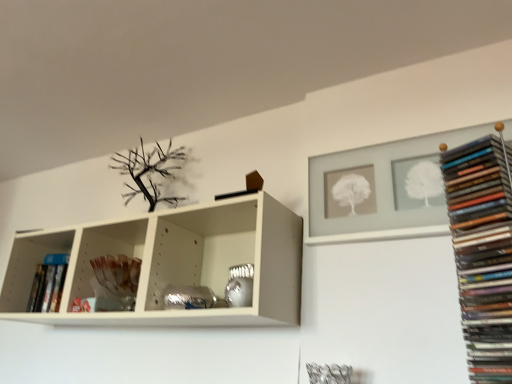
Question: Is hardcover book at left, arranged as the first book when viewed from the left, surrounded by translucent glass vase at center, the 2th shelf from the right?

Choices:
 (A) yes
 (B) no

Answer: (B)

Question: Is translucent glass vase at center, which ranks as the 2th shelf in top-to-bottom order, located outside hardcover book at left, arranged as the first book when viewed from the left?

Choices:
 (A) no
 (B) yes

Answer: (B)

Question: Is translucent glass vase at center, which ranks as the 2th shelf in top-to-bottom order, touching hardcover book at left, arranged as the first book when viewed from the left?

Choices:
 (A) no
 (B) yes

Answer: (A)

Question: Is translucent glass vase at center, placed as the 1th shelf when sorted from bottom to top, positioned with its back to hardcover book at left, which ranks as the first book in back-to-front order?

Choices:
 (A) no
 (B) yes

Answer: (A)

Question: Does translucent glass vase at center, which ranks as the 2th shelf in top-to-bottom order, have a smaller size compared to hardcover book at left, arranged as the first book when viewed from the left?

Choices:
 (A) yes
 (B) no

Answer: (B)

Question: Would you consider translucent glass vase at center, placed as the 1th shelf when sorted from bottom to top, to be distant from hardcover book at left, the 2th book positioned from the front?

Choices:
 (A) no
 (B) yes

Answer: (A)

Question: Is white matte frame at upper right, which is the 2th shelf from left to right, thinner than hardcover book at left, which ranks as the first book in back-to-front order?

Choices:
 (A) no
 (B) yes

Answer: (B)

Question: Is white matte frame at upper right, the 1th shelf positioned from the right, far from hardcover book at left, the 2th book positioned from the front?

Choices:
 (A) no
 (B) yes

Answer: (B)

Question: Is white matte frame at upper right, which is the 2th shelf from left to right, wider than hardcover book at left, the 2th book positioned from the front?

Choices:
 (A) yes
 (B) no

Answer: (B)

Question: Considering the relative positions of white matte frame at upper right, placed as the first shelf when sorted from top to bottom, and hardcover book at left, the 2th book positioned from the front, in the image provided, is white matte frame at upper right, placed as the first shelf when sorted from top to bottom, to the right of hardcover book at left, the 2th book positioned from the front, from the viewer's perspective?

Choices:
 (A) no
 (B) yes

Answer: (B)

Question: From a real-world perspective, is white matte frame at upper right, which is the 2th shelf from left to right, positioned under hardcover book at left, the 2th book positioned from the front, based on gravity?

Choices:
 (A) no
 (B) yes

Answer: (A)

Question: Is white matte frame at upper right, the 2th shelf positioned from the bottom, not within hardcover book at left, the 2th book positioned from the front?

Choices:
 (A) yes
 (B) no

Answer: (A)

Question: Does white matte frame at upper right, which is the 2th shelf from left to right, have a smaller size compared to matte black books at right, the 2th book in the left-to-right sequence?

Choices:
 (A) yes
 (B) no

Answer: (A)